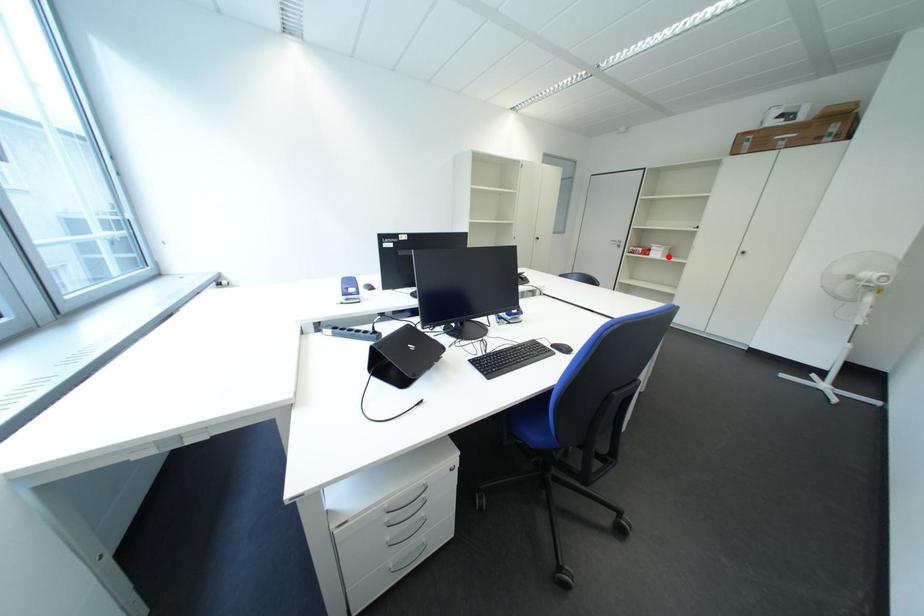
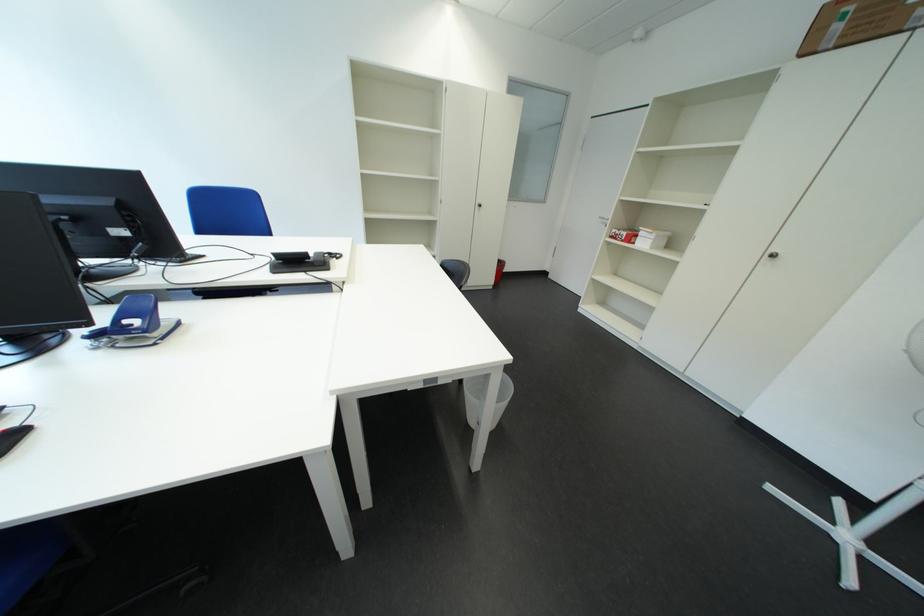
Locate, in the second image, the point that corresponds to the highlighted location in the first image.

(657, 246)